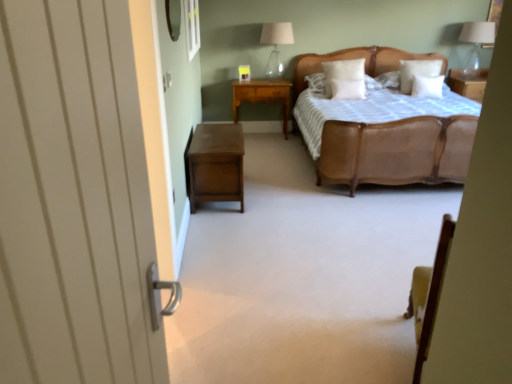
The height and width of the screenshot is (384, 512). In order to click on free space in front of leather bed at center in this screenshot , I will do `click(341, 239)`.